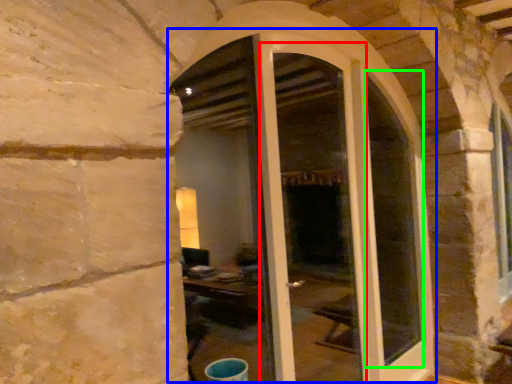
Question: Which object is the farthest from screen door (highlighted by a red box)? Choose among these: door (highlighted by a blue box) or glass window (highlighted by a green box).

Choices:
 (A) door
 (B) glass window

Answer: (A)